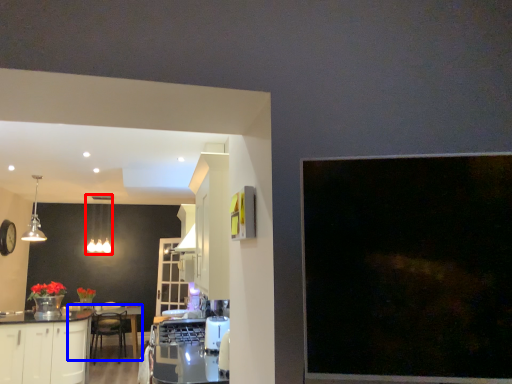
Question: Which object appears closest to the camera in this image, lighting (highlighted by a red box) or round table (highlighted by a blue box)?

Choices:
 (A) lighting
 (B) round table

Answer: (B)